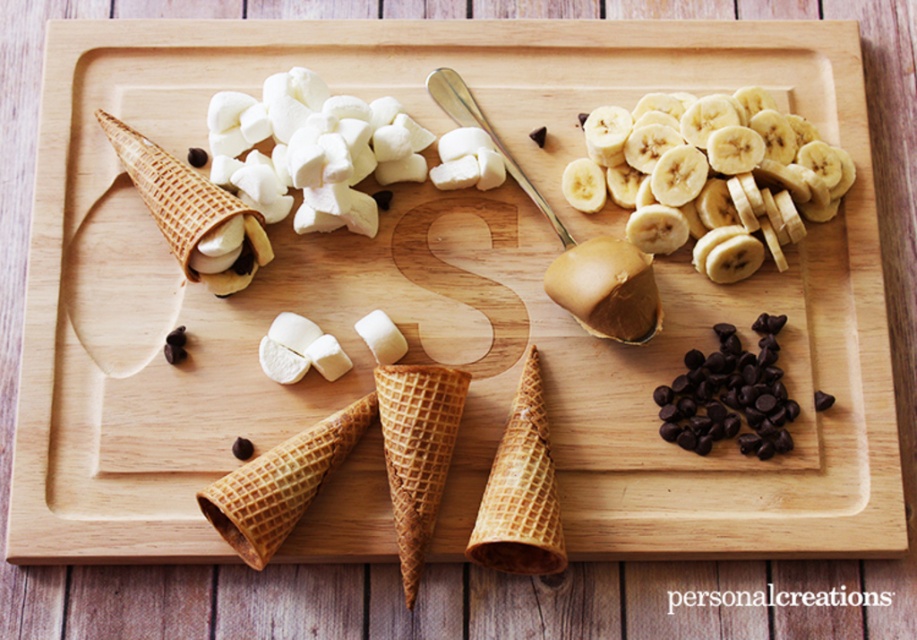
Question: Can you confirm if yellow smooth banana at upper right is thinner than dark chocolate chips at lower right?

Choices:
 (A) no
 (B) yes

Answer: (A)

Question: Is yellow smooth banana at upper right thinner than dark chocolate chips at lower right?

Choices:
 (A) no
 (B) yes

Answer: (A)

Question: Is yellow smooth banana at upper right thinner than dark chocolate chips at lower right?

Choices:
 (A) no
 (B) yes

Answer: (A)

Question: Among these objects, which one is nearest to the camera?

Choices:
 (A) dark chocolate chips at lower right
 (B) yellow smooth banana at upper right

Answer: (A)

Question: Which point appears farthest from the camera in this image?

Choices:
 (A) (698, 358)
 (B) (667, 216)

Answer: (A)